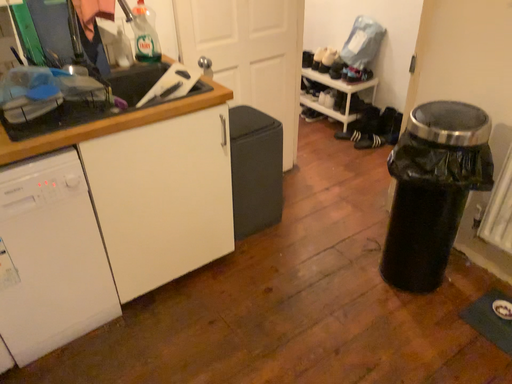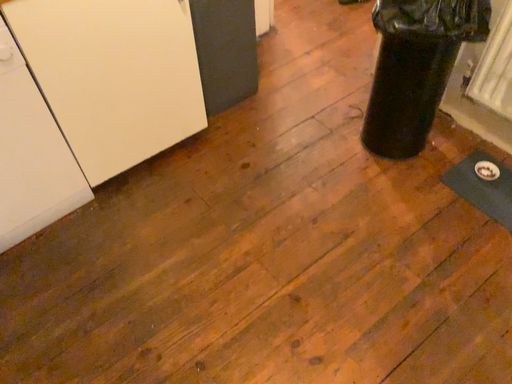
Question: How did the camera likely rotate when shooting the video?

Choices:
 (A) rotated downward
 (B) rotated upward

Answer: (A)